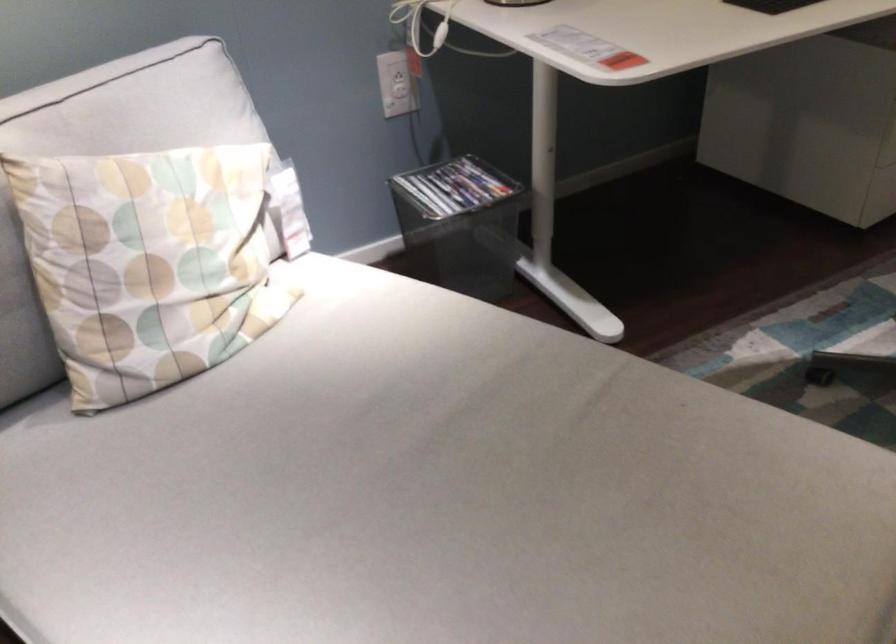
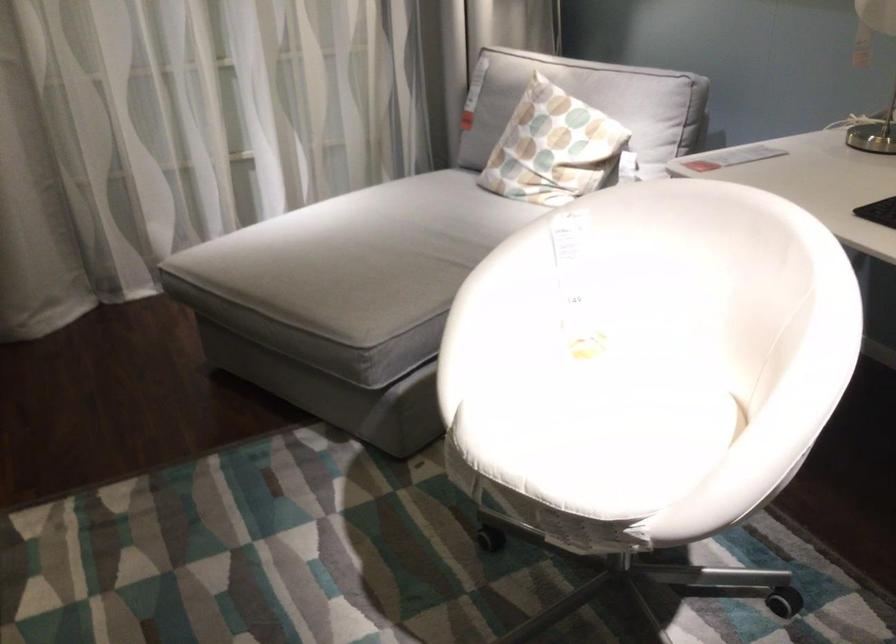
In the second image, find the point that corresponds to point (547, 550) in the first image.

(359, 256)